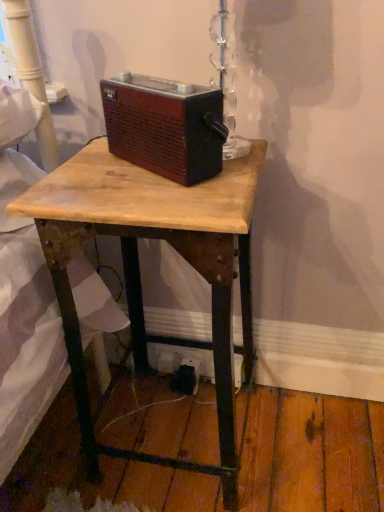
The width and height of the screenshot is (384, 512). What are the coordinates of `vacant space situated on the left part of brown wood radio at center` in the screenshot? It's located at (92, 169).